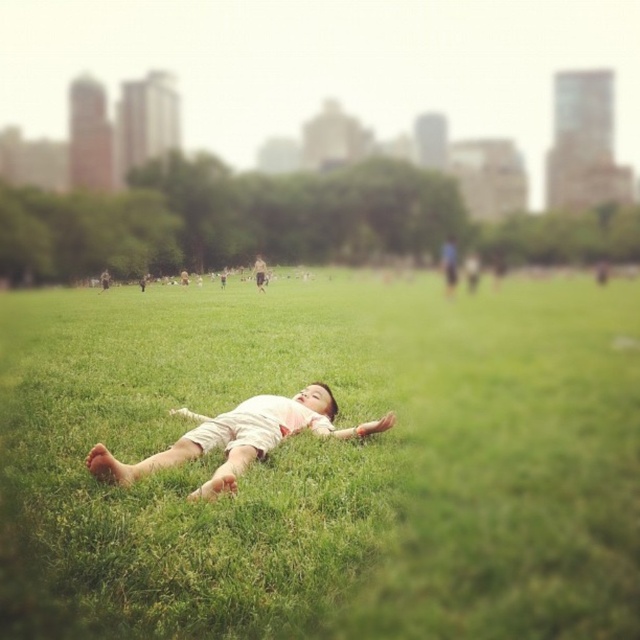
Who is shorter, green grass at center or light brown leather jacket at center?

green grass at center

Which is below, green grass at center or light brown leather jacket at center?

green grass at center

Between point (572, 385) and point (451, 246), which one is positioned in front?

Point (572, 385) is more forward.

The image size is (640, 640). I want to click on green grass at center, so click(x=326, y=461).

Between light pink cotton shirt at center and light brown leather jacket at center, which one has less height?

With less height is light pink cotton shirt at center.

Find the location of `light pink cotton shirt at center`. light pink cotton shirt at center is located at coordinates 240,438.

At what (x,y) coordinates should I click in order to perform the action: click on light pink cotton shirt at center. Please return your answer as a coordinate pair (x, y). Image resolution: width=640 pixels, height=640 pixels. Looking at the image, I should click on (240, 438).

Between green grass at center and light pink cotton shirt at center, which one is positioned lower?

light pink cotton shirt at center is lower down.

Is point (612, 285) behind point (152, 460)?

Yes, point (612, 285) is farther from viewer.

Where is `green grass at center`? The width and height of the screenshot is (640, 640). green grass at center is located at coordinates click(x=326, y=461).